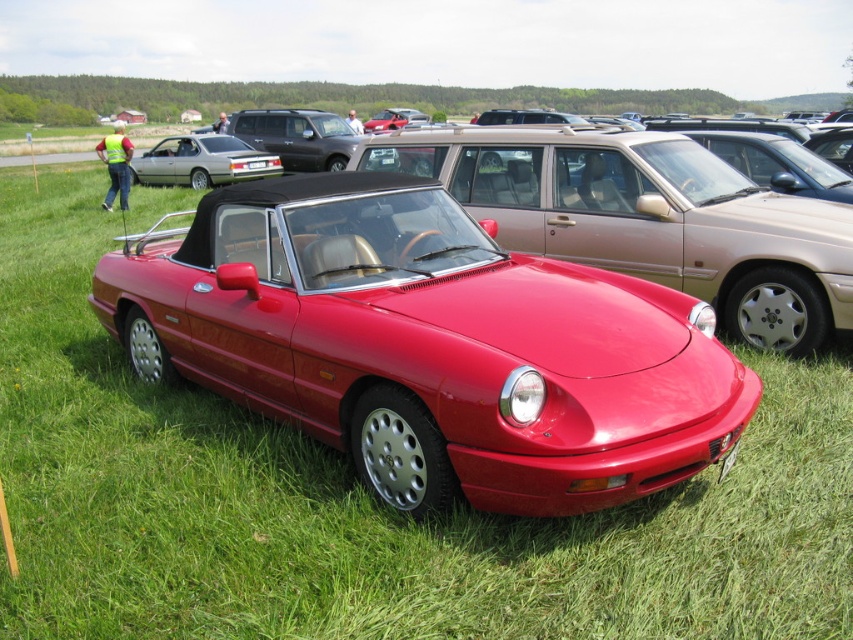
Question: Among these objects, which one is nearest to the camera?

Choices:
 (A) silver metallic sedan at center
 (B) shiny red convertible at center
 (C) white plastic license plate at center
 (D) glossy red convertible at center

Answer: (D)

Question: In this image, where is shiny red convertible at center located relative to white plastic license plate at center?

Choices:
 (A) left
 (B) right

Answer: (B)

Question: Which object is closer to the camera taking this photo?

Choices:
 (A) white plastic license plate at center
 (B) shiny red convertible at center
 (C) glossy red convertible at center

Answer: (C)

Question: Is glossy red convertible at center wider than white plastic license plate at center?

Choices:
 (A) no
 (B) yes

Answer: (B)

Question: Which object is closer to the camera taking this photo?

Choices:
 (A) glossy red convertible at center
 (B) white plastic license plate at center

Answer: (A)

Question: Can you confirm if glossy red convertible at center is bigger than shiny red convertible at center?

Choices:
 (A) no
 (B) yes

Answer: (B)